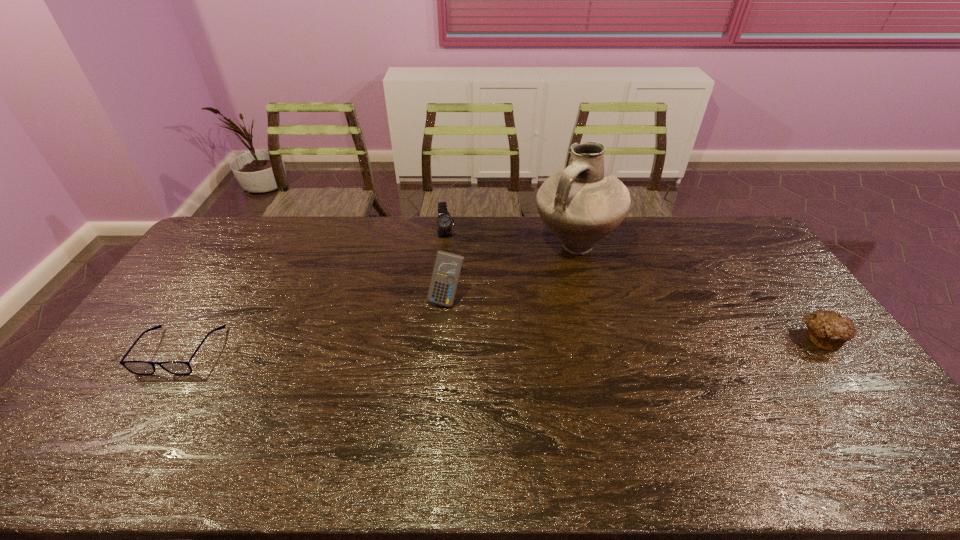
Find the location of a particular element. This screenshot has height=540, width=960. spectacles is located at coordinates point(136,367).

Locate an element on the screen. Image resolution: width=960 pixels, height=540 pixels. the shortest object is located at coordinates (136, 367).

Find the location of `the rightmost object`. the rightmost object is located at coordinates (828, 330).

Find the location of a particular element. This screenshot has width=960, height=540. the second shortest object is located at coordinates (828, 330).

Where is `the second object from right to left`? the second object from right to left is located at coordinates (581, 204).

Where is `pitcher`? This screenshot has width=960, height=540. pitcher is located at coordinates 581,204.

What are the coordinates of `watch` in the screenshot? It's located at (445, 221).

The width and height of the screenshot is (960, 540). I want to click on the second tallest object, so click(448, 266).

I want to click on the third nearest object, so click(448, 266).

Where is `vacant space located on the front-facing side of the leftmost object`? The height and width of the screenshot is (540, 960). vacant space located on the front-facing side of the leftmost object is located at coordinates (139, 415).